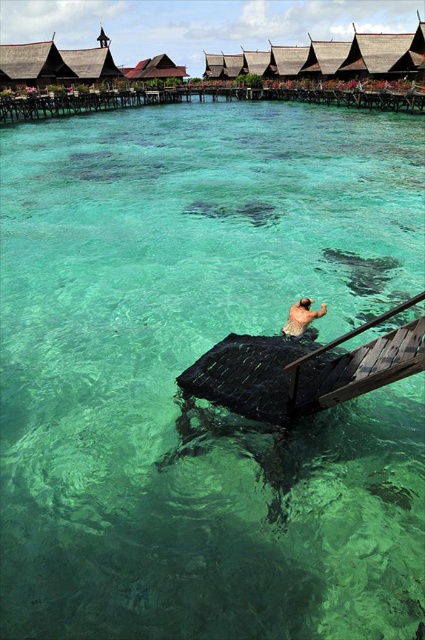
Question: Which point appears closest to the camera in this image?

Choices:
 (A) (147, 93)
 (B) (306, 323)

Answer: (B)

Question: Does wooden dock at upper center have a greater width compared to nude human at center?

Choices:
 (A) no
 (B) yes

Answer: (B)

Question: Does wooden dock at upper center appear on the left side of nude human at center?

Choices:
 (A) yes
 (B) no

Answer: (A)

Question: Can you confirm if wooden dock at upper center is positioned to the left of nude human at center?

Choices:
 (A) no
 (B) yes

Answer: (B)